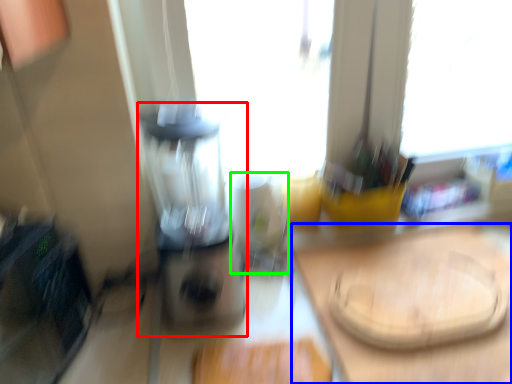
Question: Which is farther away from blender (highlighted by a red box)? counter top (highlighted by a blue box) or appliance (highlighted by a green box)?

Choices:
 (A) counter top
 (B) appliance

Answer: (A)